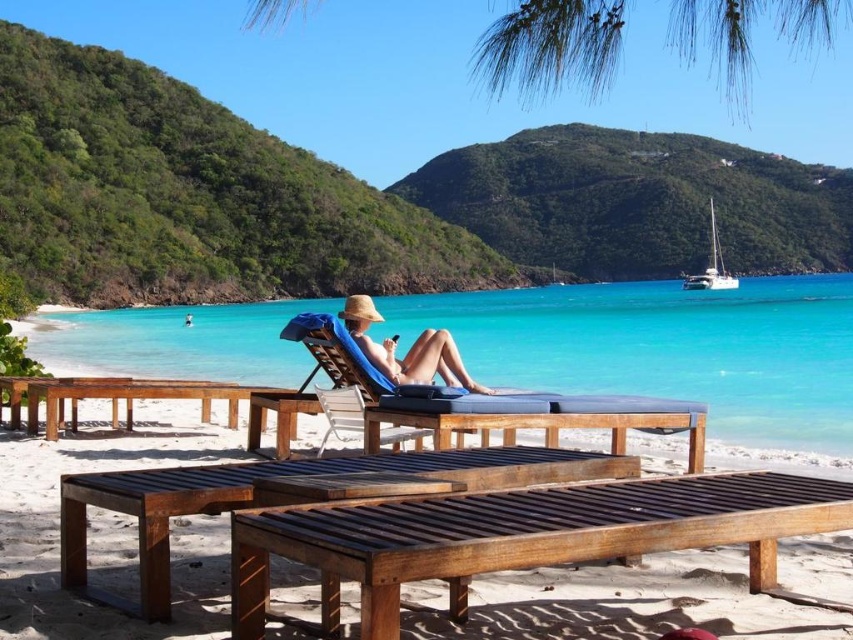
I want to click on blue fabric beach chair at center, so click(x=492, y=400).

Which is in front, point (561, 424) or point (456, 372)?

Point (561, 424)

Image resolution: width=853 pixels, height=640 pixels. What do you see at coordinates (492, 400) in the screenshot?
I see `blue fabric beach chair at center` at bounding box center [492, 400].

The image size is (853, 640). Find the location of `blue fabric beach chair at center`. blue fabric beach chair at center is located at coordinates (492, 400).

What do you see at coordinates (666, 348) in the screenshot?
I see `clear blue water at center` at bounding box center [666, 348].

Does clear blue water at center lie behind blue fabric beach chair at center?

Yes, it is behind blue fabric beach chair at center.

The image size is (853, 640). What do you see at coordinates (666, 348) in the screenshot? I see `clear blue water at center` at bounding box center [666, 348].

This screenshot has width=853, height=640. I want to click on clear blue water at center, so point(666,348).

Is point (172, 632) farther from viewer compared to point (329, 337)?

That is False.

Does brown wooden lounge chair at center come behind blue fabric beach chair at center?

No, it is not.

In order to click on brown wooden lounge chair at center in this screenshot , I will do `click(112, 468)`.